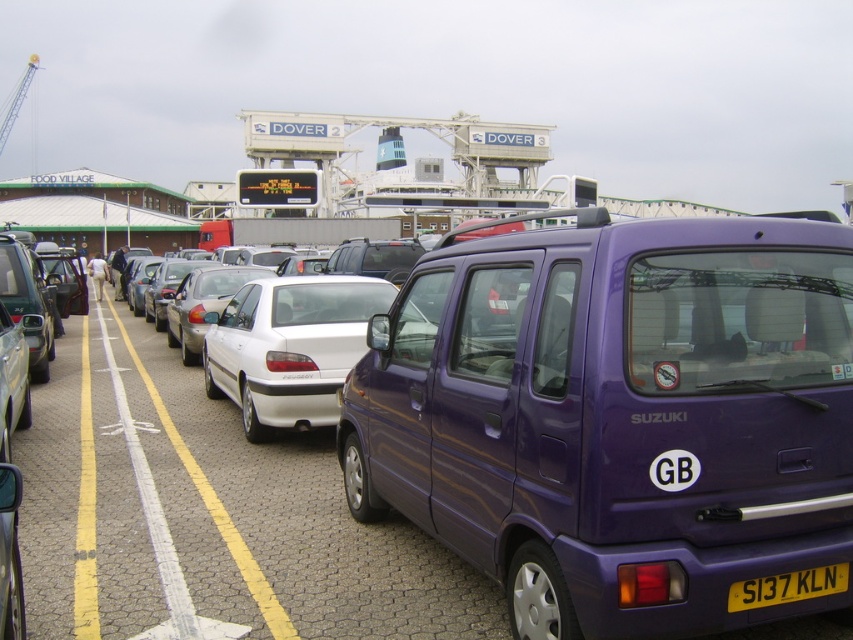
Question: Considering the real-world distances, which object is closest to the purple matte van at center?

Choices:
 (A) yellow painted line at center
 (B) white glossy car at center
 (C) yellow plastic license plate at lower right

Answer: (C)

Question: Is purple matte van at center further to the viewer compared to white glossy car at center?

Choices:
 (A) yes
 (B) no

Answer: (B)

Question: Does white glossy car at center appear on the left side of yellow plastic license plate at lower right?

Choices:
 (A) yes
 (B) no

Answer: (A)

Question: Can you confirm if purple matte van at center is positioned above yellow painted line at center?

Choices:
 (A) no
 (B) yes

Answer: (B)

Question: Which point is farther from the camera taking this photo?

Choices:
 (A) (225, 531)
 (B) (80, 628)
 (C) (688, 492)
 (D) (834, 579)

Answer: (A)

Question: Which point appears closest to the camera in this image?

Choices:
 (A) (816, 570)
 (B) (85, 512)
 (C) (113, 316)

Answer: (A)